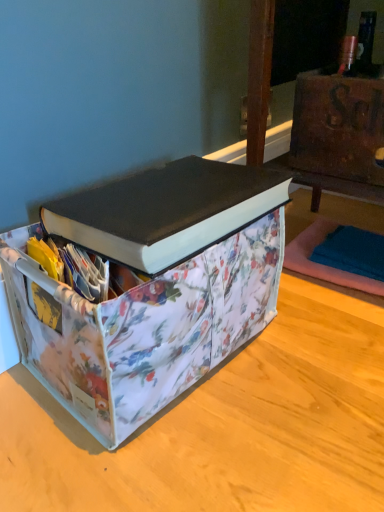
Image resolution: width=384 pixels, height=512 pixels. Find the location of `blank space above teal fabric yoga mat at lower right (from a real-world perspective)`. blank space above teal fabric yoga mat at lower right (from a real-world perspective) is located at coordinates (354, 250).